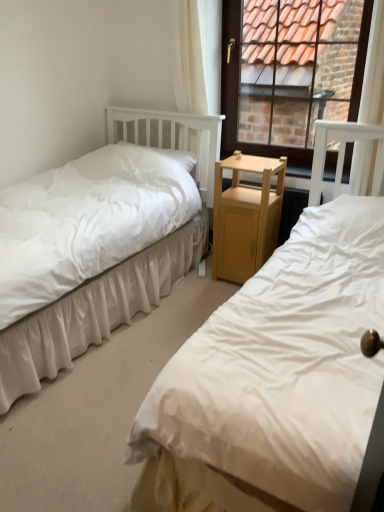
Question: Is white fabric bed at left, positioned as the second bed in right-to-left order, bigger or smaller than white sheer curtain at upper center?

Choices:
 (A) small
 (B) big

Answer: (B)

Question: Does point (97, 344) appear closer or farther from the camera than point (177, 103)?

Choices:
 (A) farther
 (B) closer

Answer: (B)

Question: Which of these objects is positioned closest to the white fabric bed at left, which ranks as the first bed in right-to-left order?

Choices:
 (A) white fabric bed at left, positioned as the second bed in right-to-left order
 (B) white sheer curtain at upper center
 (C) light wood nightstand at center
 (D) brown wooden window at upper center

Answer: (C)

Question: Which object is the closest to the white sheer curtain at upper center?

Choices:
 (A) brown wooden window at upper center
 (B) white fabric bed at left, which ranks as the second bed in left-to-right order
 (C) light wood nightstand at center
 (D) white fabric bed at left, the first bed positioned from the left

Answer: (D)